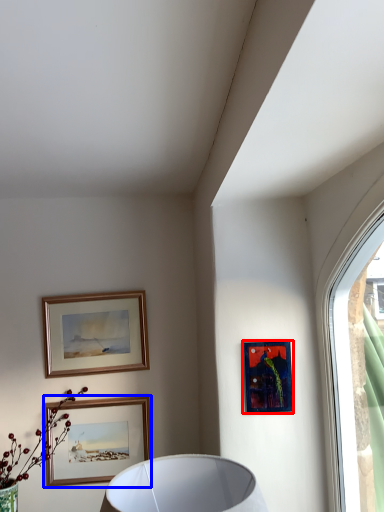
Question: Which object appears farthest to the camera in this image, picture frame (highlighted by a red box) or picture frame (highlighted by a blue box)?

Choices:
 (A) picture frame
 (B) picture frame

Answer: (B)